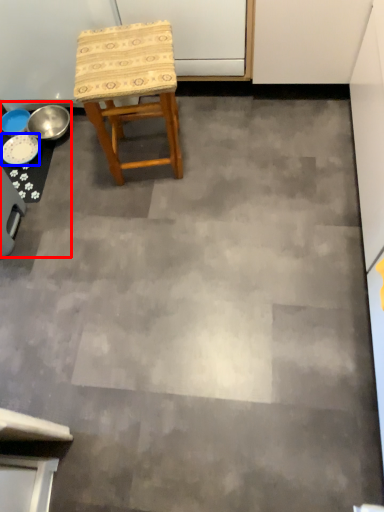
Question: Which object is closer to the camera taking this photo, table (highlighted by a red box) or plate (highlighted by a blue box)?

Choices:
 (A) table
 (B) plate

Answer: (A)